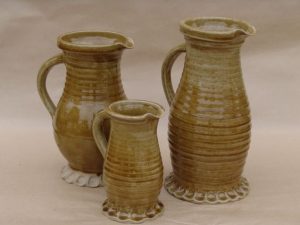
Identify the location of large pitcher handle. (167, 69).